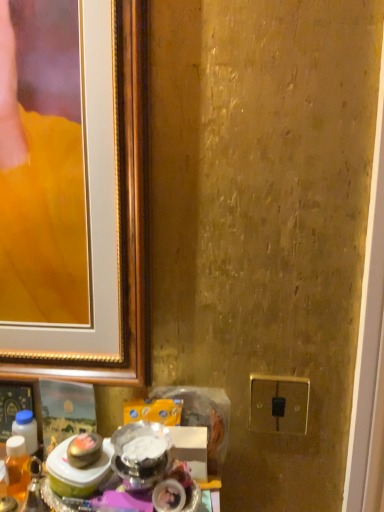
Where is `gold metallic switch at lower right`? gold metallic switch at lower right is located at coordinates (279, 404).

Image resolution: width=384 pixels, height=512 pixels. What do you see at coordinates (279, 404) in the screenshot?
I see `gold metallic switch at lower right` at bounding box center [279, 404].

In order to face translucent amber liquid at lower left, should I rotate leftwards or rightwards?

Turn left by 23.705 degrees to look at translucent amber liquid at lower left.

What do you see at coordinates (17, 467) in the screenshot? Image resolution: width=384 pixels, height=512 pixels. I see `translucent amber liquid at lower left` at bounding box center [17, 467].

This screenshot has height=512, width=384. In order to click on translucent amber liquid at lower left in this screenshot , I will do `click(17, 467)`.

Find the location of `gold metallic switch at lower right`. gold metallic switch at lower right is located at coordinates (279, 404).

Considering the relative positions of gold metallic switch at lower right and translucent amber liquid at lower left in the image provided, is gold metallic switch at lower right to the left or to the right of translucent amber liquid at lower left?

Clearly, gold metallic switch at lower right is on the right of translucent amber liquid at lower left in the image.

Considering their positions, is gold metallic switch at lower right located in front of or behind translucent amber liquid at lower left?

In the image, gold metallic switch at lower right appears behind translucent amber liquid at lower left.

Is point (278, 378) more distant than point (21, 476)?

Yes, it is.

From the image's perspective, relative to translucent amber liquid at lower left, is gold metallic switch at lower right above or below?

gold metallic switch at lower right is situated higher than translucent amber liquid at lower left in the image.

From a real-world perspective, is gold metallic switch at lower right located beneath translucent amber liquid at lower left?

Incorrect, from a real-world perspective, gold metallic switch at lower right is higher than translucent amber liquid at lower left.

Can you confirm if gold metallic switch at lower right is thinner than translucent amber liquid at lower left?

Yes.

Which of these two, gold metallic switch at lower right or translucent amber liquid at lower left, stands taller?

With more height is translucent amber liquid at lower left.

Can you confirm if gold metallic switch at lower right is smaller than translucent amber liquid at lower left?

Yes.

Is gold metallic switch at lower right surrounding translucent amber liquid at lower left?

No, translucent amber liquid at lower left is not surrounded by gold metallic switch at lower right.

Does gold metallic switch at lower right touch translucent amber liquid at lower left?

gold metallic switch at lower right and translucent amber liquid at lower left are not in contact.

Is gold metallic switch at lower right aimed at translucent amber liquid at lower left?

No, gold metallic switch at lower right is not turned towards translucent amber liquid at lower left.

Measure the distance between gold metallic switch at lower right and translucent amber liquid at lower left.

→ gold metallic switch at lower right is 19.00 inches from translucent amber liquid at lower left.

Locate an element on the screen. The height and width of the screenshot is (512, 384). beverage below the gold metallic switch at lower right (from the image's perspective) is located at coordinates (17, 467).

Which object is positioned more to the right, translucent amber liquid at lower left or gold metallic switch at lower right?

gold metallic switch at lower right.

Which object is further away from the camera, translucent amber liquid at lower left or gold metallic switch at lower right?

gold metallic switch at lower right.

Considering the positions of points (20, 479) and (302, 413), is point (20, 479) farther from camera compared to point (302, 413)?

That is False.

From the image's perspective, between translucent amber liquid at lower left and gold metallic switch at lower right, who is located below?

translucent amber liquid at lower left is shown below in the image.

From a real-world perspective, is translucent amber liquid at lower left on gold metallic switch at lower right?

Actually, translucent amber liquid at lower left is physically below gold metallic switch at lower right in the real world.

Which object is thinner, translucent amber liquid at lower left or gold metallic switch at lower right?

gold metallic switch at lower right is thinner.

Consider the image. Does translucent amber liquid at lower left have a lesser height compared to gold metallic switch at lower right?

No, translucent amber liquid at lower left is not shorter than gold metallic switch at lower right.

In terms of size, does translucent amber liquid at lower left appear bigger or smaller than gold metallic switch at lower right?

In the image, translucent amber liquid at lower left appears to be larger than gold metallic switch at lower right.

Choose the correct answer: Is translucent amber liquid at lower left inside gold metallic switch at lower right or outside it?

translucent amber liquid at lower left is not enclosed by gold metallic switch at lower right.

Is the surface of translucent amber liquid at lower left in direct contact with gold metallic switch at lower right?

No, translucent amber liquid at lower left is not next to gold metallic switch at lower right.

Is translucent amber liquid at lower left oriented towards gold metallic switch at lower right?

No, translucent amber liquid at lower left is not facing towards gold metallic switch at lower right.

How many degrees apart are the facing directions of translucent amber liquid at lower left and gold metallic switch at lower right?

translucent amber liquid at lower left and gold metallic switch at lower right are facing 5.38 degrees away from each other.

Locate an element on the screen. beverage below the gold metallic switch at lower right (from a real-world perspective) is located at coordinates (17, 467).

Where is `electric outlet that is on the right side of translucent amber liquid at lower left`? The height and width of the screenshot is (512, 384). electric outlet that is on the right side of translucent amber liquid at lower left is located at coordinates (279, 404).

At what (x,y) coordinates should I click in order to perform the action: click on beverage to the left of gold metallic switch at lower right. Please return your answer as a coordinate pair (x, y). Looking at the image, I should click on (17, 467).